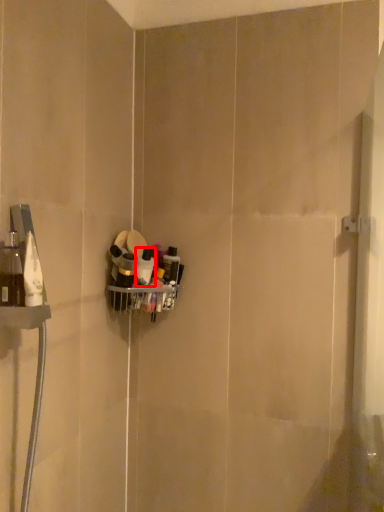
Question: From the image's perspective, considering the relative positions of toiletry (annotated by the red box) and toiletry in the image provided, where is toiletry (annotated by the red box) located with respect to the staircase?

Choices:
 (A) above
 (B) below

Answer: (B)